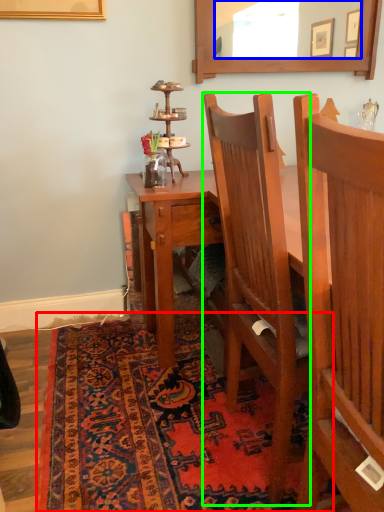
Question: Which object is positioned closest to mat (highlighted by a red box)? Select from mirror (highlighted by a blue box) and chair (highlighted by a green box).

Choices:
 (A) mirror
 (B) chair

Answer: (B)